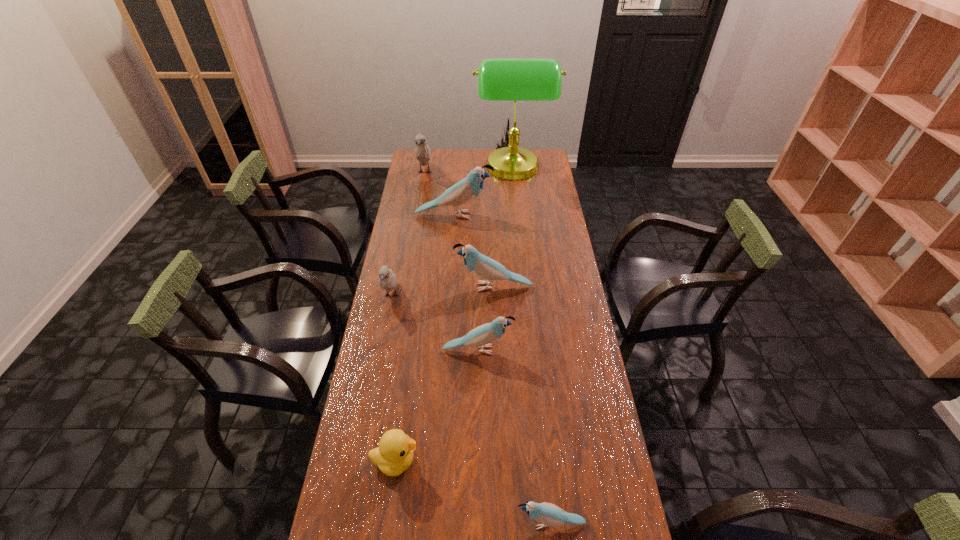
At what (x,y) coordinates should I click in order to perform the action: click on vacant space located at the face of the third nearest blue bird. Please return your answer as a coordinate pair (x, y). Image resolution: width=960 pixels, height=540 pixels. Looking at the image, I should click on (409, 287).

At what (x,y) coordinates should I click in order to perform the action: click on free region located at the face of the third nearest blue bird. Please return your answer as a coordinate pair (x, y). The image size is (960, 540). Looking at the image, I should click on (406, 287).

This screenshot has width=960, height=540. I want to click on vacant area located at the beak of the nearer white bird, so click(x=385, y=329).

Find the location of a particular element. The image size is (960, 540). vacant space located 0.240m at the face of the second smallest blue bird is located at coordinates (583, 350).

I want to click on vacant position located on the face of the yellow duck, so click(537, 461).

At what (x,y) coordinates should I click in order to perform the action: click on free spot located 0.080m at the face of the nearest blue bird. Please return your answer as a coordinate pair (x, y). This screenshot has height=540, width=960. Looking at the image, I should click on (484, 523).

Find the location of a particular element. This screenshot has width=960, height=540. vacant space located 0.230m at the face of the nearest blue bird is located at coordinates (425, 523).

At what (x,y) coordinates should I click in order to perform the action: click on vacant region located 0.340m at the face of the nearest blue bird. Please return your answer as a coordinate pair (x, y). Image resolution: width=960 pixels, height=540 pixels. Looking at the image, I should click on (383, 523).

At what (x,y) coordinates should I click in order to perform the action: click on lamp present at the far edge. Please return your answer as a coordinate pair (x, y). The image size is (960, 540). Looking at the image, I should click on (499, 79).

Locate an element on the screen. The height and width of the screenshot is (540, 960). bird that is at the far edge is located at coordinates (422, 151).